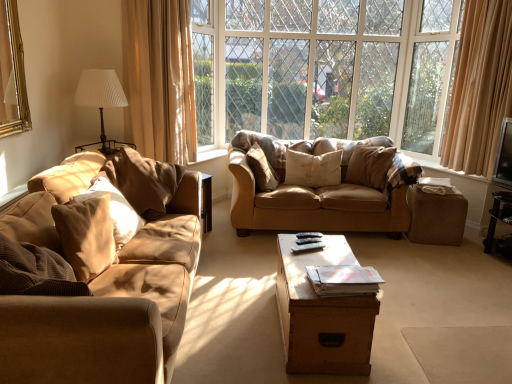
Question: In the image, is suede-like beige pillow at left, marked as the first pillow in a left-to-right arrangement, positioned in front of or behind suede-like beige pillow at center, which is counted as the second pillow, starting from the right?

Choices:
 (A) front
 (B) behind

Answer: (A)

Question: Visually, is suede-like beige pillow at left, marked as the first pillow in a left-to-right arrangement, positioned to the left or to the right of suede-like beige pillow at center, which is counted as the second pillow, starting from the right?

Choices:
 (A) right
 (B) left

Answer: (B)

Question: Which object is positioned farthest from the suede-like beige pillow at center, which is counted as the second pillow, starting from the right?

Choices:
 (A) brown fabric stool at right
 (B) white pleated fabric lampshade at upper left
 (C) wooden trunk at center
 (D) suede-like beige pillow at left, the sixth pillow in the right-to-left sequence
 (E) beige fabric curtain at upper left

Answer: (D)

Question: Which is farther from the brown corduroy pillow at left, marked as the third pillow in a left-to-right arrangement?

Choices:
 (A) beige fabric pillow at center, the first pillow in the right-to-left sequence
 (B) plush brown pillow at center, positioned as the third pillow in right-to-left order
 (C) suede-like beige pillow at left, marked as the first pillow in a left-to-right arrangement
 (D) wooden trunk at center
 (E) beige fabric curtain at upper left

Answer: (A)